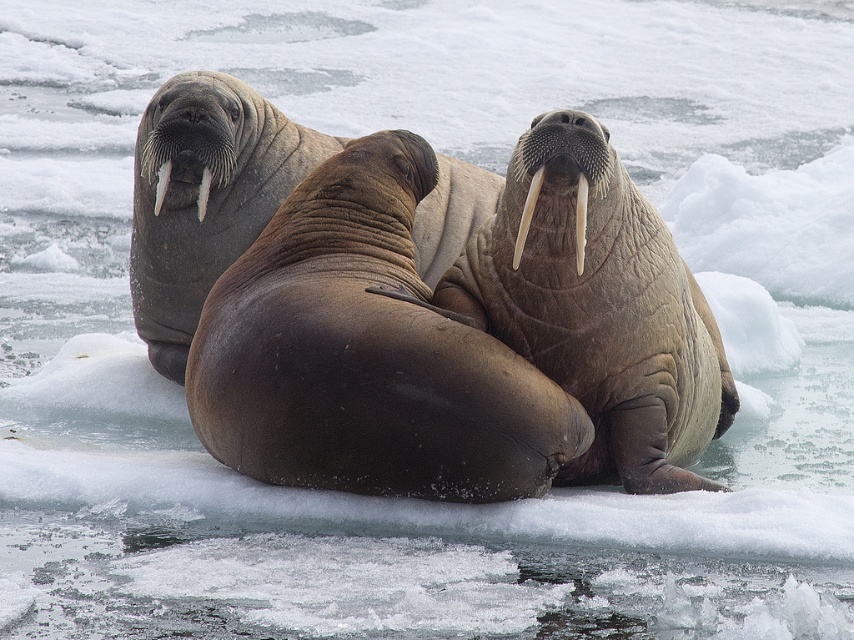
You are a wildlife photographer aiming to capture the walrus with brown wrinkled skin at center. Based on the coordinates provided, where should you focus your camera to ensure the walrus is in the center of your shot?

The brown wrinkled skin at center is located at coordinates point (600, 310), so focusing the camera there will center the walrus in the shot.

You are a wildlife photographer aiming to capture a closeup of the brown wrinkled skin at center and the white ivory tusk at upper left. If your camera can only focus on objects within a 1 meter width, will both fit in the frame?

The brown wrinkled skin at center is wider than the white ivory tusk at upper left, but since the camera can focus on objects within 1 meter width, both can fit as long as their combined width doesn